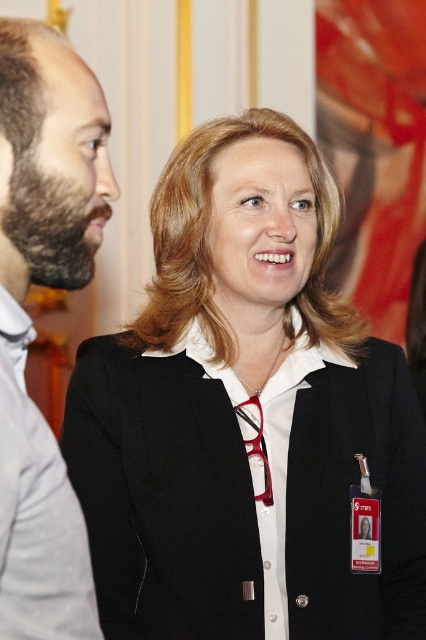
Question: Which object is closer to the camera taking this photo?

Choices:
 (A) white cotton dress shirt at left
 (B) black matte blazer at center

Answer: (A)

Question: Is black matte blazer at center to the left of bearded man at left from the viewer's perspective?

Choices:
 (A) no
 (B) yes

Answer: (A)

Question: Which object is the farthest from the black matte blazer at center?

Choices:
 (A) bearded man at left
 (B) white cotton dress shirt at left

Answer: (A)

Question: Which point appears farthest from the camera in this image?

Choices:
 (A) (276, 483)
 (B) (8, 410)
 (C) (37, 248)

Answer: (A)

Question: Does black matte blazer at center have a lesser width compared to bearded man at left?

Choices:
 (A) yes
 (B) no

Answer: (B)

Question: Considering the relative positions of bearded man at left and white cotton dress shirt at left in the image provided, where is bearded man at left located with respect to white cotton dress shirt at left?

Choices:
 (A) above
 (B) below

Answer: (A)